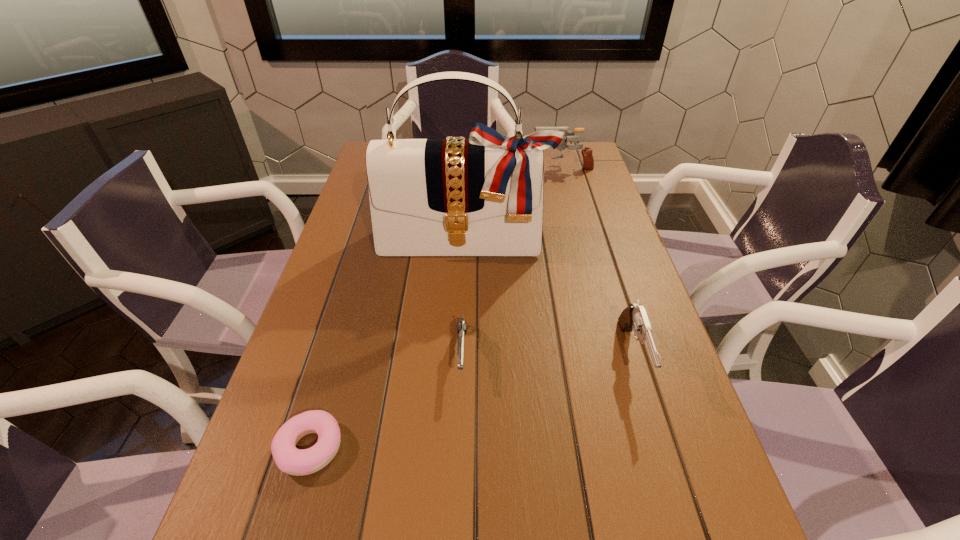
In order to click on free space between the fourth tallest object and the satchel in this screenshot , I will do `click(464, 298)`.

Find the location of a particular element. The height and width of the screenshot is (540, 960). free space between the fourth tallest object and the nearest object is located at coordinates (386, 401).

I want to click on object that is the nearest to the tallest object, so click(x=462, y=325).

Choose which object is the fourth nearest neighbor to the farthest object. Please provide its 2D coordinates. Your answer should be formatted as a tuple, i.e. [(x, y)], where the tuple contains the x and y coordinates of a point satisfying the conditions above.

[(289, 459)]

Select which gun is the second closest to the shortest gun. Please provide its 2D coordinates. Your answer should be formatted as a tuple, i.e. [(x, y)], where the tuple contains the x and y coordinates of a point satisfying the conditions above.

[(588, 162)]

Locate an element on the screen. The width and height of the screenshot is (960, 540). gun that is the second closest to the pastry is located at coordinates (633, 318).

Image resolution: width=960 pixels, height=540 pixels. In order to click on vacant space that satisfies the following two spatial constraints: 1. at the barrel end of the tallest gun; 2. aiming along the barrel of the second shortest object in this screenshot , I will do `click(612, 354)`.